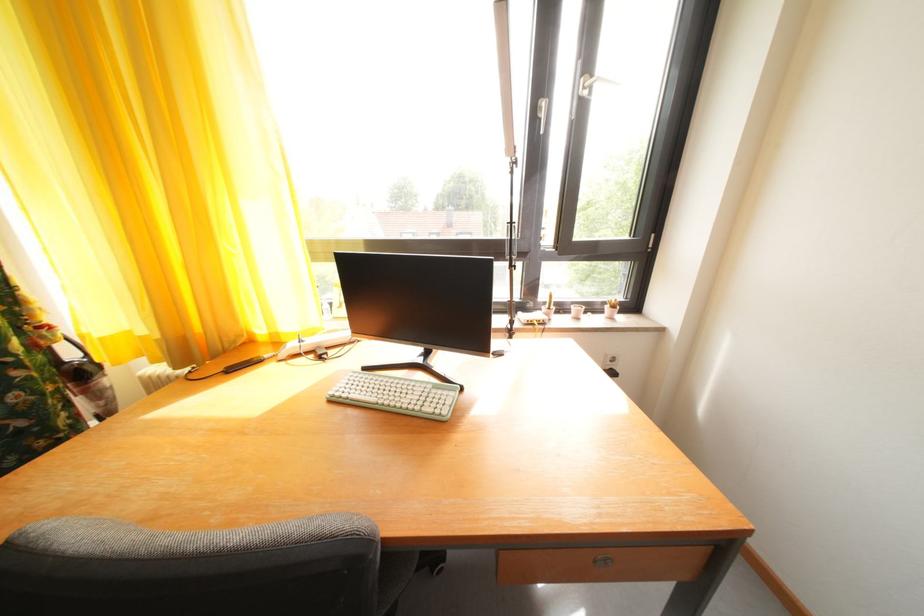
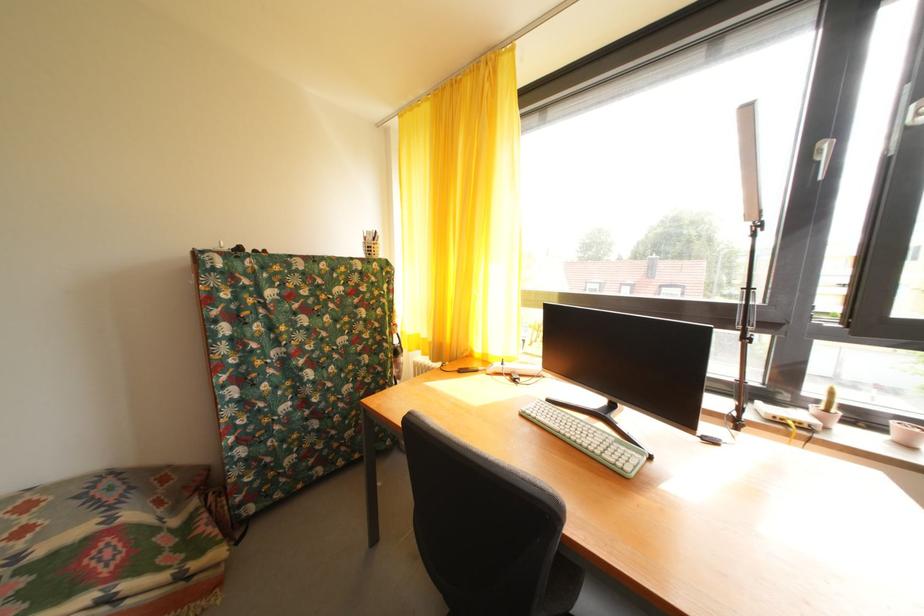
In the second image, find the point that corresponds to pixel 558 315 in the first image.

(836, 416)